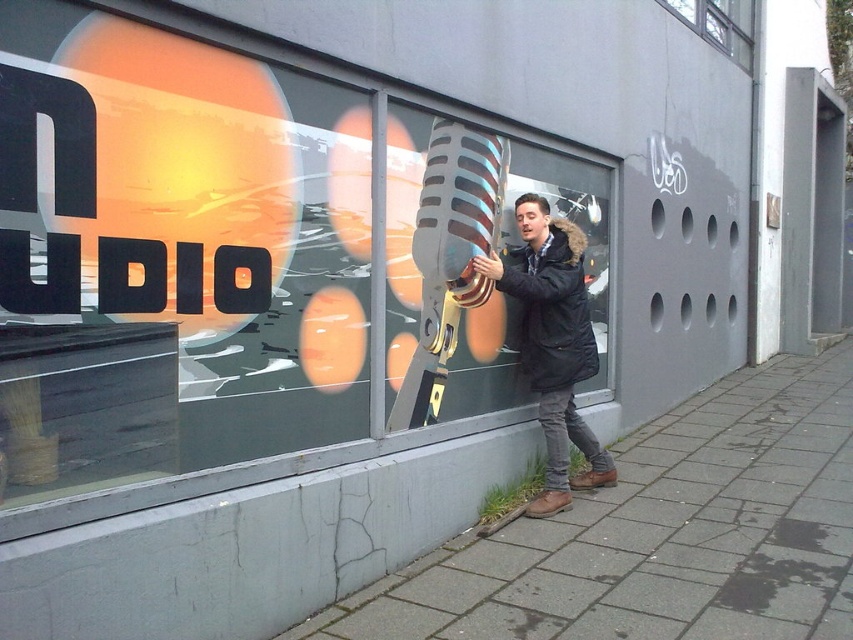
Question: Estimate the real-world distances between objects in this image. Which object is farther from the gray concrete pavement at lower right?

Choices:
 (A) black matte jacket at center
 (B) clear glass window at upper center

Answer: (B)

Question: Does black matte jacket at center appear under clear glass window at upper center?

Choices:
 (A) yes
 (B) no

Answer: (A)

Question: Which of the following is the farthest from the observer?

Choices:
 (A) (650, 595)
 (B) (692, 28)
 (C) (125, 81)

Answer: (B)

Question: Can you confirm if metallic glass microphone at center is positioned above clear glass window at upper center?

Choices:
 (A) yes
 (B) no

Answer: (B)

Question: Is metallic glass microphone at center wider than gray concrete pavement at lower right?

Choices:
 (A) yes
 (B) no

Answer: (A)

Question: Which point appears farthest from the camera in this image?

Choices:
 (A) (418, 616)
 (B) (735, 24)
 (C) (492, 253)

Answer: (B)